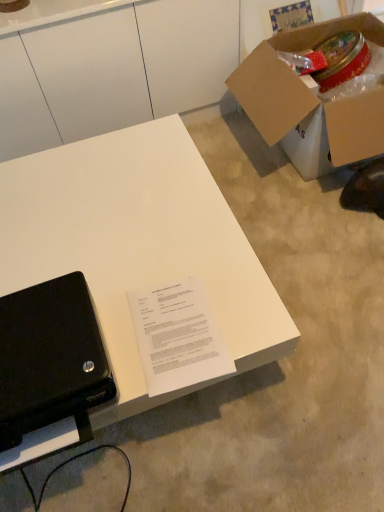
Question: Can you confirm if cardboard box at upper right is bigger than black matte laptop at lower left?

Choices:
 (A) yes
 (B) no

Answer: (A)

Question: Is cardboard box at upper right next to black matte laptop at lower left and touching it?

Choices:
 (A) yes
 (B) no

Answer: (B)

Question: Is cardboard box at upper right not close to black matte laptop at lower left?

Choices:
 (A) no
 (B) yes

Answer: (B)

Question: Considering the relative sizes of cardboard box at upper right and black matte laptop at lower left in the image provided, is cardboard box at upper right wider than black matte laptop at lower left?

Choices:
 (A) yes
 (B) no

Answer: (A)

Question: Would you say black matte laptop at lower left is part of cardboard box at upper right's contents?

Choices:
 (A) no
 (B) yes

Answer: (A)

Question: Looking at the image, does cardboard box at upper right seem bigger or smaller compared to white paper at center?

Choices:
 (A) small
 (B) big

Answer: (B)

Question: In the image, is cardboard box at upper right positioned in front of or behind white paper at center?

Choices:
 (A) behind
 (B) front

Answer: (A)

Question: Would you say cardboard box at upper right is to the left or to the right of white paper at center in the picture?

Choices:
 (A) right
 (B) left

Answer: (A)

Question: Considering the positions of point (370, 95) and point (134, 312), is point (370, 95) closer or farther from the camera than point (134, 312)?

Choices:
 (A) closer
 (B) farther

Answer: (B)

Question: Is white paper at center bigger or smaller than black matte laptop at lower left?

Choices:
 (A) small
 (B) big

Answer: (A)

Question: Is white paper at center in front of or behind black matte laptop at lower left in the image?

Choices:
 (A) front
 (B) behind

Answer: (B)

Question: Does point (172, 325) appear closer or farther from the camera than point (8, 428)?

Choices:
 (A) farther
 (B) closer

Answer: (A)

Question: Would you say white paper at center is to the left or to the right of black matte laptop at lower left in the picture?

Choices:
 (A) left
 (B) right

Answer: (B)

Question: Looking at the image, does cardboard box at upper right seem bigger or smaller compared to black matte laptop at lower left?

Choices:
 (A) big
 (B) small

Answer: (A)

Question: Based on their positions, is cardboard box at upper right located to the left or right of black matte laptop at lower left?

Choices:
 (A) right
 (B) left

Answer: (A)